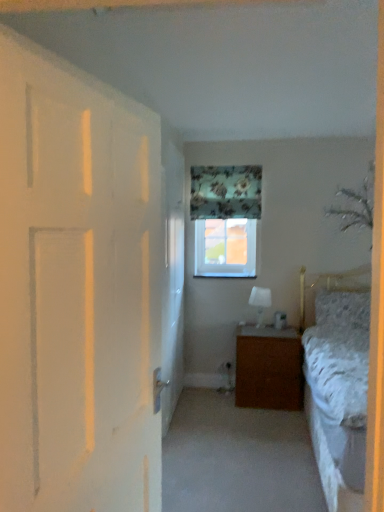
Find the location of a particular element. free location to the left of brown wooden nightstand at center is located at coordinates [x=210, y=398].